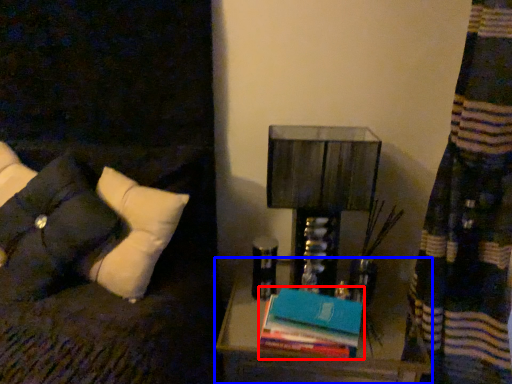
Question: Which object appears closest to the camera in this image, book (highlighted by a red box) or nightstand (highlighted by a blue box)?

Choices:
 (A) book
 (B) nightstand

Answer: (A)